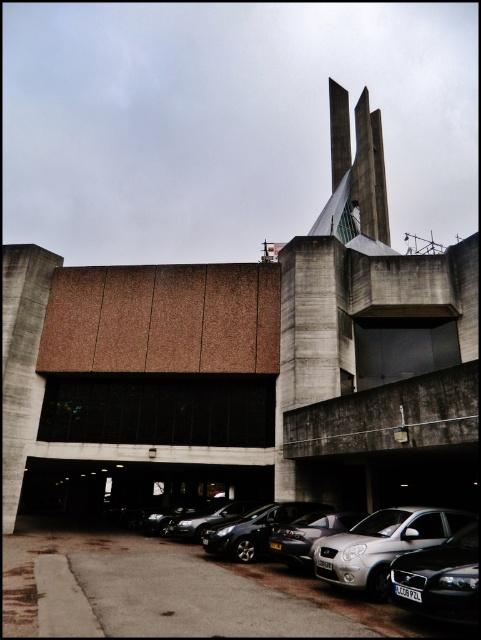
Question: Which point is closer to the camera taking this photo?

Choices:
 (A) (203, 516)
 (B) (295, 518)

Answer: (B)

Question: Among these points, which one is nearest to the camera?

Choices:
 (A) (228, 499)
 (B) (293, 538)
 (C) (299, 513)

Answer: (B)

Question: In this image, where is silver metallic hatchback at center located relative to silver metallic sedan at center?

Choices:
 (A) above
 (B) below

Answer: (B)

Question: Is black metallic car at lower right bigger than silver metallic sedan at center?

Choices:
 (A) no
 (B) yes

Answer: (A)

Question: Considering the real-world distances, which object is farthest from the silver metallic sedan at center?

Choices:
 (A) black metallic car at lower right
 (B) shiny silver car at center

Answer: (B)

Question: Is silver metallic hatchback at center to the left of silver metallic sedan at center from the viewer's perspective?

Choices:
 (A) yes
 (B) no

Answer: (A)